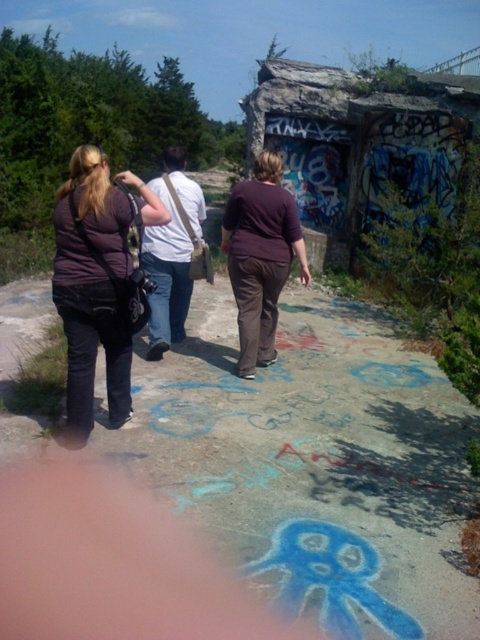
Does concrete sidewalk at center have a greater width compared to white fabric bag at center?

Indeed, concrete sidewalk at center has a greater width compared to white fabric bag at center.

How far apart are concrete sidewalk at center and white fabric bag at center?

concrete sidewalk at center and white fabric bag at center are 1.12 meters apart.

Identify the location of concrete sidewalk at center. This screenshot has height=640, width=480. (314, 464).

Image resolution: width=480 pixels, height=640 pixels. I want to click on concrete sidewalk at center, so click(x=314, y=464).

Between matte black pants at center and white fabric bag at center, which one is positioned higher?

Positioned higher is white fabric bag at center.

Is matte black pants at center further to the viewer compared to white fabric bag at center?

No, matte black pants at center is closer to the viewer.

Is point (82, 285) less distant than point (197, 216)?

Yes, it is in front of point (197, 216).

The height and width of the screenshot is (640, 480). I want to click on matte black pants at center, so click(93, 289).

Is matte purple shirt at center below white fabric bag at center?

Correct, matte purple shirt at center is located below white fabric bag at center.

Locate an element on the screen. The image size is (480, 640). matte purple shirt at center is located at coordinates (261, 257).

Is point (272, 362) positioned after point (192, 205)?

Yes, it is behind point (192, 205).

What are the coordinates of `matte purple shirt at center` in the screenshot? It's located at (261, 257).